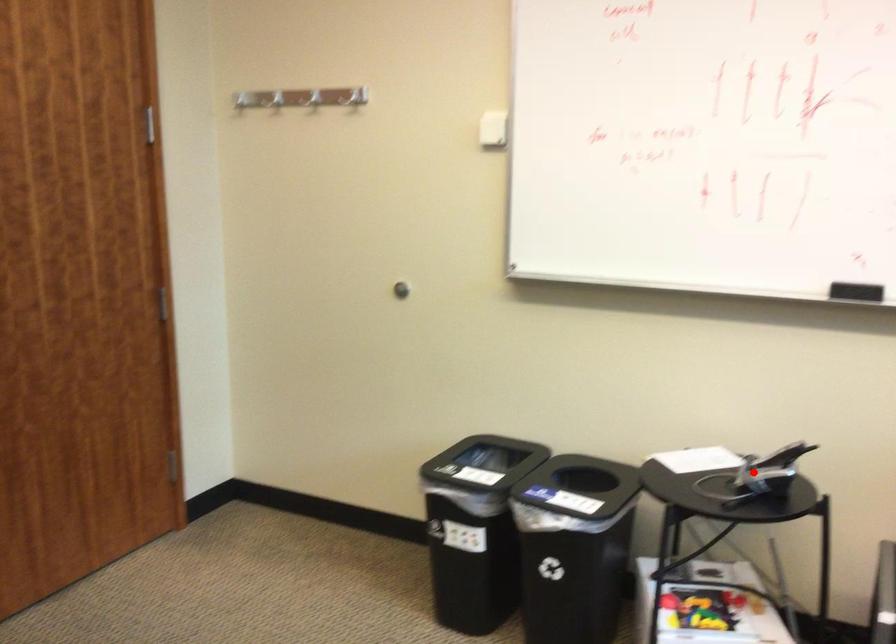
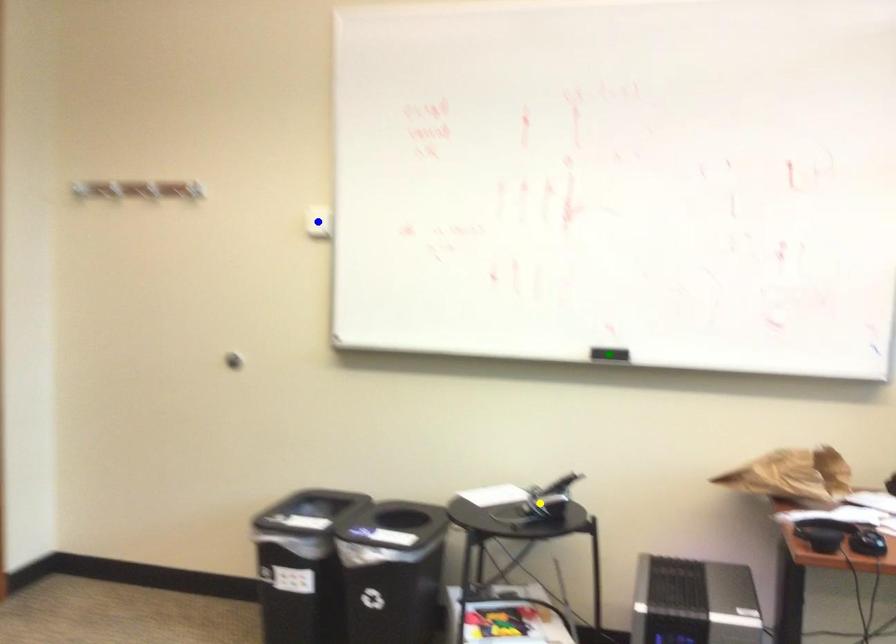
Question: I am providing you with two images of the same scene from different viewpoints. A red point is marked on the first image. You are given multiple points on the second image. In image 2, which mark is for the same physical point as the one in image 1?

Choices:
 (A) yellow point
 (B) blue point
 (C) green point

Answer: (A)